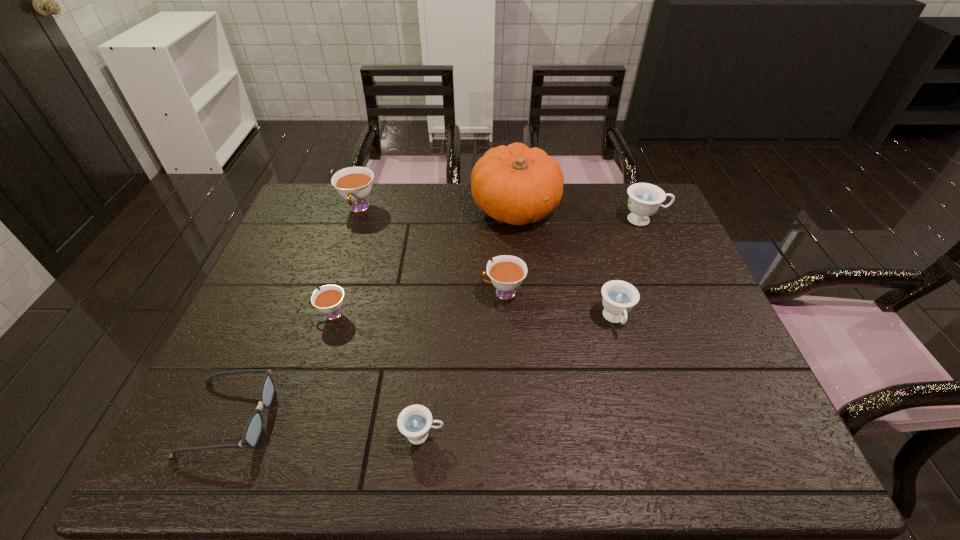
Find the location of `object present at the far left corner`. object present at the far left corner is located at coordinates tap(354, 184).

Find the location of a particular element. This screenshot has height=540, width=960. object that is at the near left corner is located at coordinates (254, 426).

Image resolution: width=960 pixels, height=540 pixels. In order to click on object that is at the far right corner in this screenshot , I will do `click(644, 199)`.

At what (x,y) coordinates should I click in order to perform the action: click on free space at the far edge of the desktop. Please return your answer as a coordinate pair (x, y). Image resolution: width=960 pixels, height=540 pixels. Looking at the image, I should click on (396, 195).

In the image, there is a desktop. Identify the location of free space at the near edge. (588, 447).

What are the coordinates of `vacant space at the right edge` in the screenshot? It's located at (689, 286).

You are a GUI agent. You are given a task and a screenshot of the screen. Output one action in this format:
    pyautogui.click(x=<x>, y=<y>)
    Task: Click on the free spot between the second smallest white teacup and the nearest teacup
    
    Given the screenshot: What is the action you would take?
    pyautogui.click(x=463, y=364)

Identify the location of free space between the smallest white teacup and the smallest blue teacup. This screenshot has width=960, height=540. (377, 374).

Identify the location of free space between the rightmost object and the second biggest blue teacup. (630, 269).

This screenshot has width=960, height=540. Find the location of `vacant area that lies between the rightmost white teacup and the rightmost teacup`. vacant area that lies between the rightmost white teacup and the rightmost teacup is located at coordinates (573, 256).